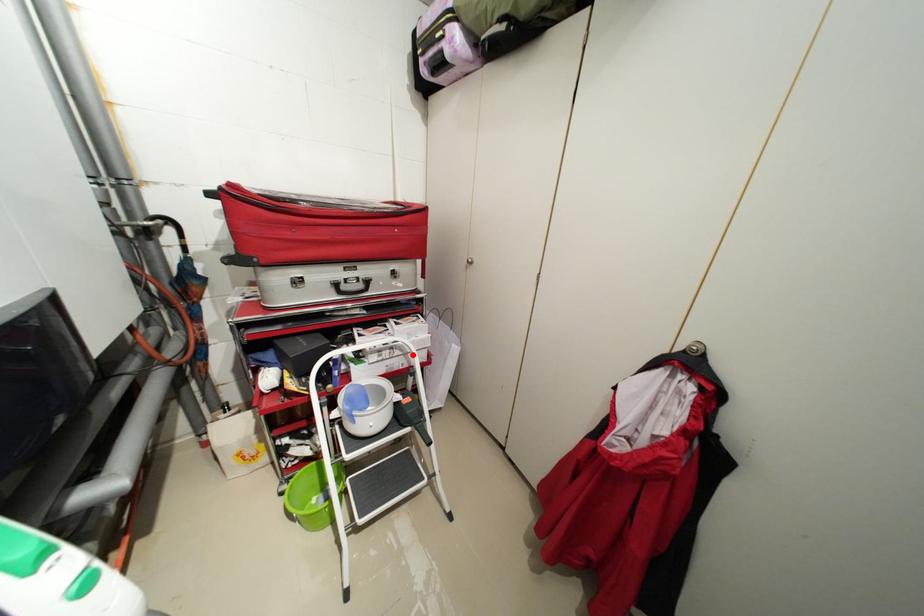
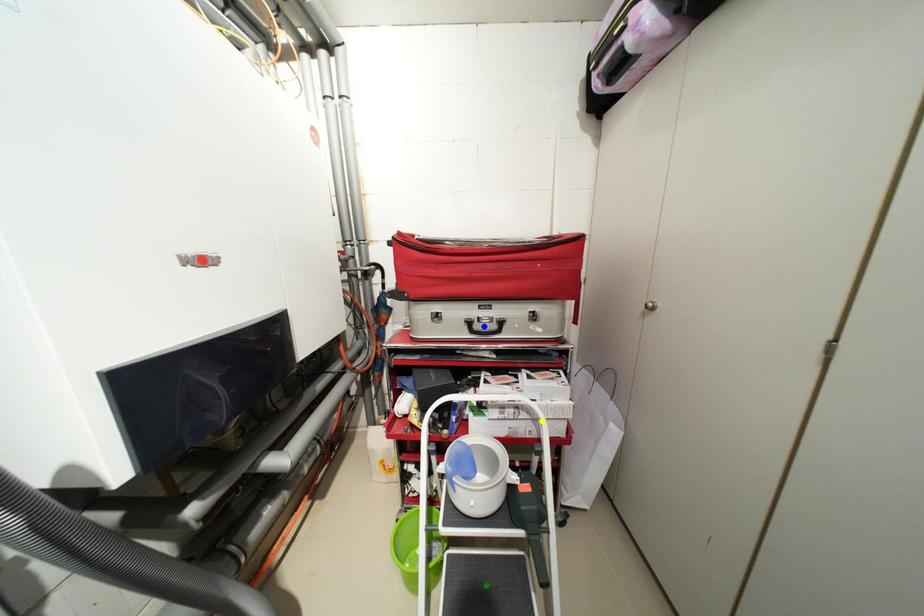
Question: I am providing you with two images of the same scene from different viewpoints. A red point is marked on the first image. You are given multiple points on the second image. Which spot in image 2 lines up with the point in image 1?

Choices:
 (A) green point
 (B) yellow point
 (C) blue point

Answer: (B)